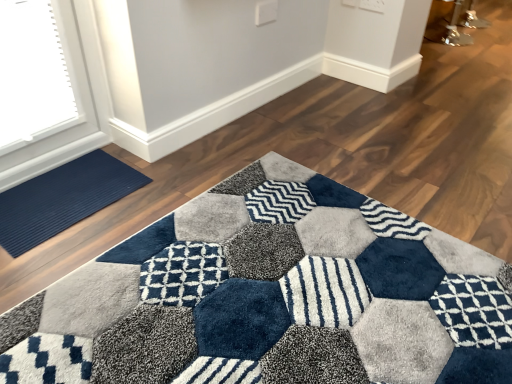
Image resolution: width=512 pixels, height=384 pixels. What do you see at coordinates (63, 199) in the screenshot?
I see `navy blue rubber mat at lower left` at bounding box center [63, 199].

Identify the location of navy blue rubber mat at lower left. (63, 199).

Locate an element on the screen. The width and height of the screenshot is (512, 384). navy blue rubber mat at lower left is located at coordinates (63, 199).